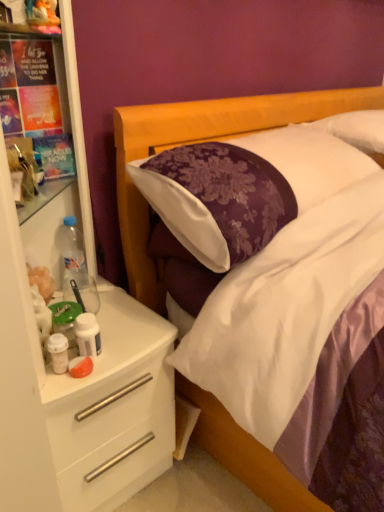
Question: Does white plastic drawer at left lie behind white plastic dresser at left?

Choices:
 (A) no
 (B) yes

Answer: (B)

Question: From a real-world perspective, is white plastic drawer at left over white plastic dresser at left?

Choices:
 (A) no
 (B) yes

Answer: (A)

Question: Does white plastic drawer at left appear on the right side of white plastic dresser at left?

Choices:
 (A) no
 (B) yes

Answer: (B)

Question: Can you confirm if white plastic drawer at left is thinner than white plastic dresser at left?

Choices:
 (A) yes
 (B) no

Answer: (B)

Question: Can you confirm if white plastic drawer at left is wider than white plastic dresser at left?

Choices:
 (A) yes
 (B) no

Answer: (A)

Question: From the image's perspective, relative to clear plastic bottle at left, placed as the 2th bottle when sorted from right to left, is white plastic dresser at left above or below?

Choices:
 (A) above
 (B) below

Answer: (A)

Question: Looking at the image, does white plastic dresser at left seem bigger or smaller compared to clear plastic bottle at left, placed as the 2th bottle when sorted from right to left?

Choices:
 (A) small
 (B) big

Answer: (B)

Question: In terms of height, does white plastic dresser at left look taller or shorter compared to clear plastic bottle at left, the first bottle positioned from the back?

Choices:
 (A) tall
 (B) short

Answer: (A)

Question: Based on their positions, is white plastic dresser at left located to the left or right of clear plastic bottle at left, the first bottle from the top?

Choices:
 (A) left
 (B) right

Answer: (B)

Question: Looking at their shapes, would you say white plastic dresser at left is wider or thinner than white plastic drawer at left?

Choices:
 (A) wide
 (B) thin

Answer: (B)

Question: Considering the positions of white plastic dresser at left and white plastic drawer at left in the image, is white plastic dresser at left taller or shorter than white plastic drawer at left?

Choices:
 (A) tall
 (B) short

Answer: (A)

Question: Do you think white plastic dresser at left is within white plastic drawer at left, or outside of it?

Choices:
 (A) inside
 (B) outside

Answer: (B)

Question: From the image's perspective, relative to white plastic drawer at left, is white plastic dresser at left above or below?

Choices:
 (A) above
 (B) below

Answer: (A)

Question: Looking at their shapes, would you say white plastic drawer at left is wider or thinner than plush fabric toy at upper left?

Choices:
 (A) wide
 (B) thin

Answer: (A)

Question: In the image, is white plastic drawer at left on the left side or the right side of plush fabric toy at upper left?

Choices:
 (A) right
 (B) left

Answer: (A)